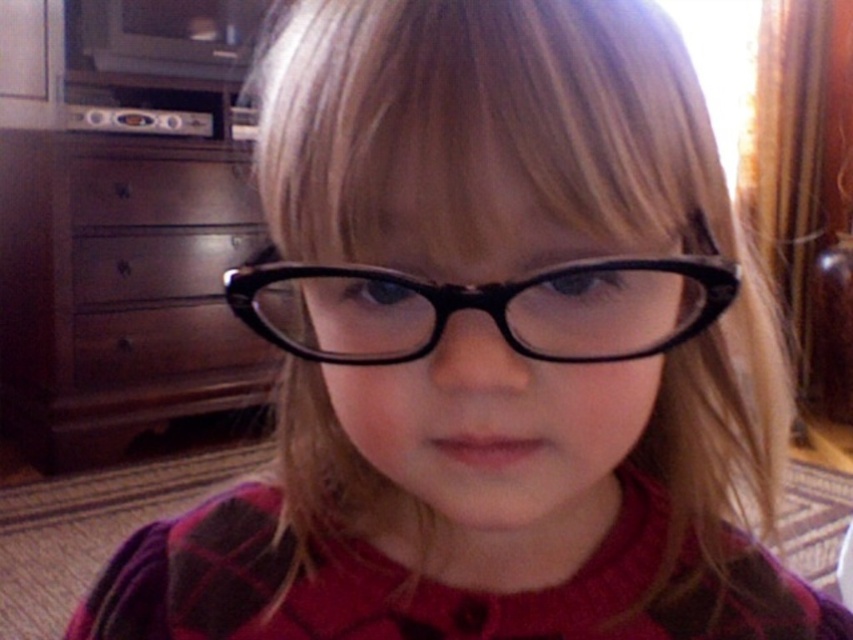
Does satin silver drawer at center have a greater height compared to brushed metal drawer at center?

No, satin silver drawer at center is not taller than brushed metal drawer at center.

Can you confirm if satin silver drawer at center is positioned below brushed metal drawer at center?

No, satin silver drawer at center is not below brushed metal drawer at center.

Is point (160, 182) positioned in front of point (132, 278)?

No.

I want to click on satin silver drawer at center, so click(161, 193).

Is brown wood drawer at center smaller than satin silver drawer at center?

Yes, brown wood drawer at center is smaller than satin silver drawer at center.

Is brown wood drawer at center bigger than satin silver drawer at center?

No.

Is point (155, 323) in front of point (131, 157)?

No, it is not.

You are a GUI agent. You are given a task and a screenshot of the screen. Output one action in this format:
    pyautogui.click(x=<x>, y=<y>)
    Task: Click on the brown wood drawer at center
    The height and width of the screenshot is (640, 853).
    Given the screenshot: What is the action you would take?
    pyautogui.click(x=161, y=342)

How distant is brown wood dresser at left from brushed metal drawer at center?

brown wood dresser at left and brushed metal drawer at center are 6.70 inches apart from each other.

Where is `brown wood dresser at left`? brown wood dresser at left is located at coordinates (120, 289).

Where is `brown wood dresser at left`? Image resolution: width=853 pixels, height=640 pixels. brown wood dresser at left is located at coordinates (120, 289).